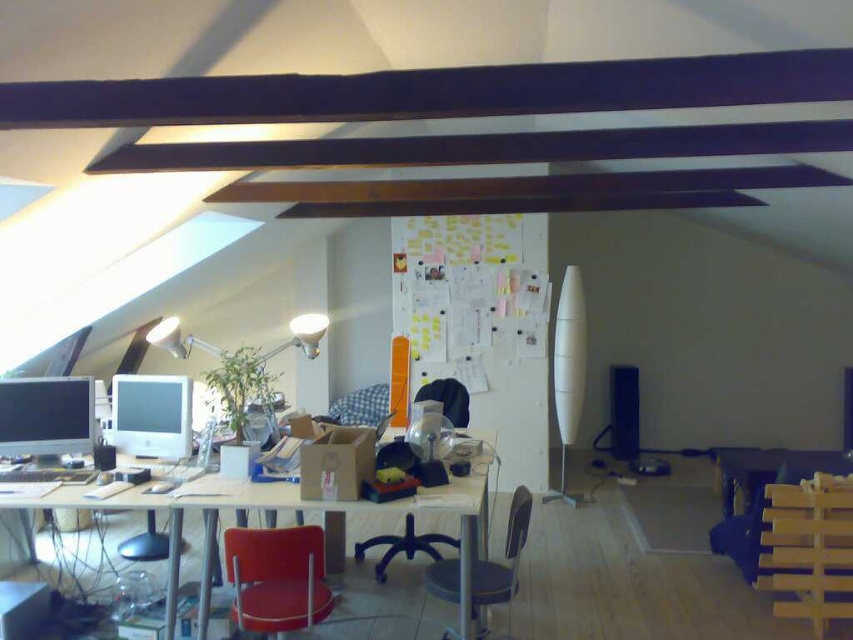
Who is lower down, white glossy computer desk at center or matte black monitor at left?

white glossy computer desk at center

Locate an element on the screen. The width and height of the screenshot is (853, 640). white glossy computer desk at center is located at coordinates (302, 509).

This screenshot has width=853, height=640. In order to click on white glossy computer desk at center in this screenshot , I will do `click(302, 509)`.

Who is positioned more to the left, white glossy computer desk at center or white glossy computer monitor at center?

white glossy computer monitor at center is more to the left.

Does white glossy computer desk at center have a larger size compared to white glossy computer monitor at center?

Indeed, white glossy computer desk at center has a larger size compared to white glossy computer monitor at center.

Describe the element at coordinates (302, 509) in the screenshot. This screenshot has width=853, height=640. I see `white glossy computer desk at center` at that location.

In order to click on white glossy computer desk at center in this screenshot , I will do `click(302, 509)`.

Is white glossy computer desk at center thinner than matte black chair at center?

In fact, white glossy computer desk at center might be wider than matte black chair at center.

In the scene shown: Who is more forward, (x=474, y=528) or (x=375, y=577)?

Point (x=474, y=528) is more forward.

Where is `white glossy computer desk at center`? The image size is (853, 640). white glossy computer desk at center is located at coordinates (302, 509).